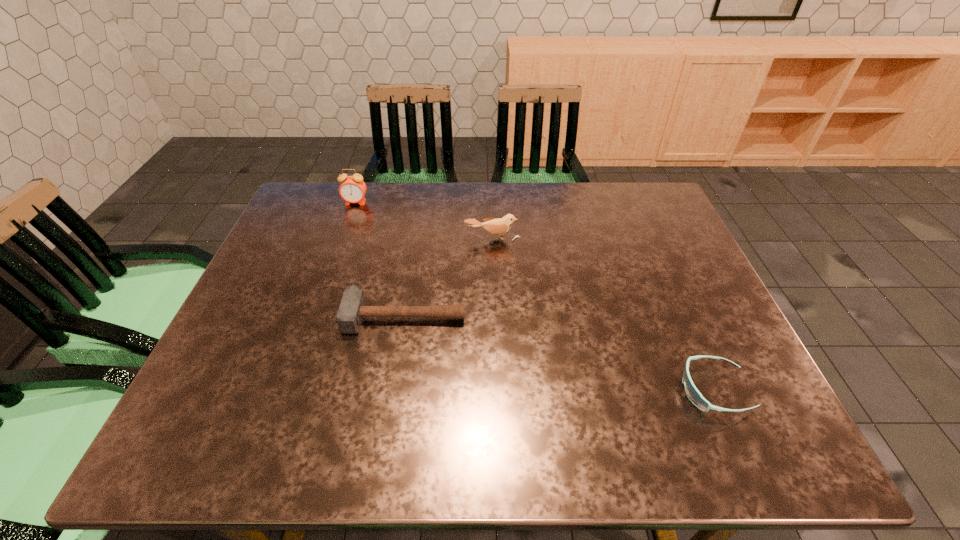
Identify the location of the leftmost object. (352, 189).

What are the coordinates of `alarm clock` in the screenshot? It's located at (352, 189).

You are a GUI agent. You are given a task and a screenshot of the screen. Output one action in this format:
    pyautogui.click(x=<x>, y=<y>)
    Task: Click on the third nearest object
    The image size is (960, 540).
    Given the screenshot: What is the action you would take?
    pyautogui.click(x=498, y=226)

Find the location of a particular element. the second tallest object is located at coordinates [498, 226].

At what (x,y) coordinates should I click in order to perform the action: click on hammer. Please return your answer as a coordinate pair (x, y). The height and width of the screenshot is (540, 960). Looking at the image, I should click on (352, 309).

Locate an element on the screen. the rightmost object is located at coordinates tap(693, 394).

Locate an element on the screen. the nearest object is located at coordinates (693, 394).

At what (x,y) coordinates should I click in order to perform the action: click on vacant region located on the face of the alarm clock. Please return your answer as a coordinate pair (x, y). The height and width of the screenshot is (540, 960). Looking at the image, I should click on (333, 266).

Where is `free space located at the beak of the bird`? free space located at the beak of the bird is located at coordinates (494, 302).

Find the location of `free space located on the striking surface of the hammer`. free space located on the striking surface of the hammer is located at coordinates (389, 409).